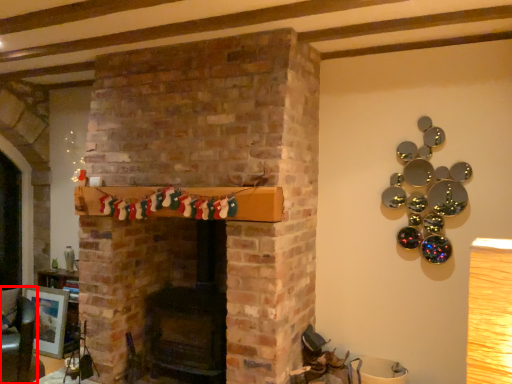
Question: In this image, where is armchair (annotated by the red box) located relative to picture frame?

Choices:
 (A) left
 (B) right

Answer: (B)